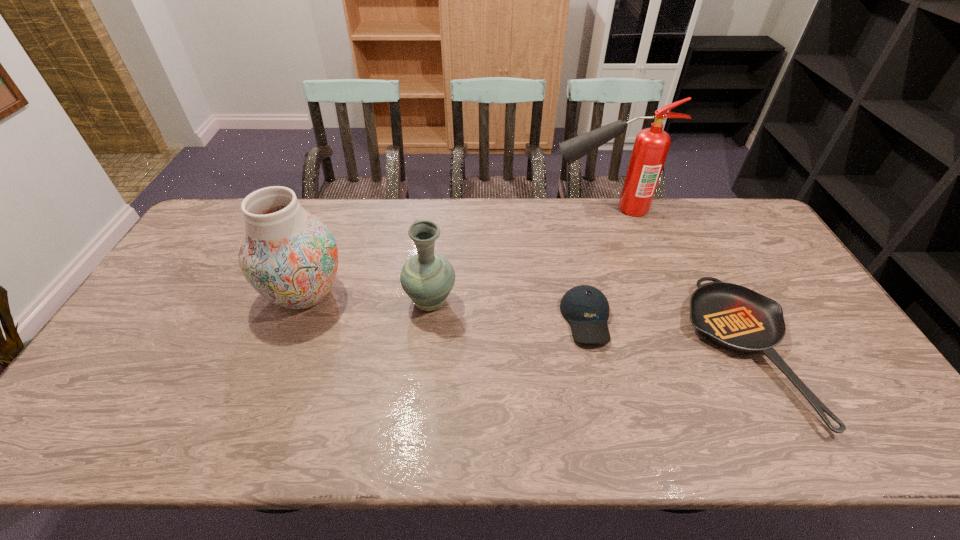
This screenshot has width=960, height=540. What are the coordinates of `free space located 0.280m at the nozzle of the fire extinguisher` in the screenshot? It's located at pyautogui.click(x=473, y=208).

Locate an element on the screen. vacant space located 0.360m on the back of the leftmost object is located at coordinates (342, 199).

Where is `vacant region located 0.170m on the handle side of the third shortest object`? vacant region located 0.170m on the handle side of the third shortest object is located at coordinates (437, 247).

Identify the location of blank space located 0.200m on the handle side of the third shortest object. This screenshot has height=540, width=960. (437, 241).

Where is `vacant area located 0.240m on the handle side of the third shortest object`? Image resolution: width=960 pixels, height=540 pixels. vacant area located 0.240m on the handle side of the third shortest object is located at coordinates (438, 233).

Image resolution: width=960 pixels, height=540 pixels. I want to click on free spot located 0.260m on the front-facing side of the baseball cap, so click(x=614, y=446).

I want to click on vacant point located on the back of the shortest object, so click(x=682, y=228).

The image size is (960, 540). In order to click on object at the far edge in this screenshot , I will do `click(651, 146)`.

The image size is (960, 540). Find the location of `object present at the near edge`. object present at the near edge is located at coordinates (737, 318).

Locate an element on the screen. object situated at the right edge is located at coordinates (737, 318).